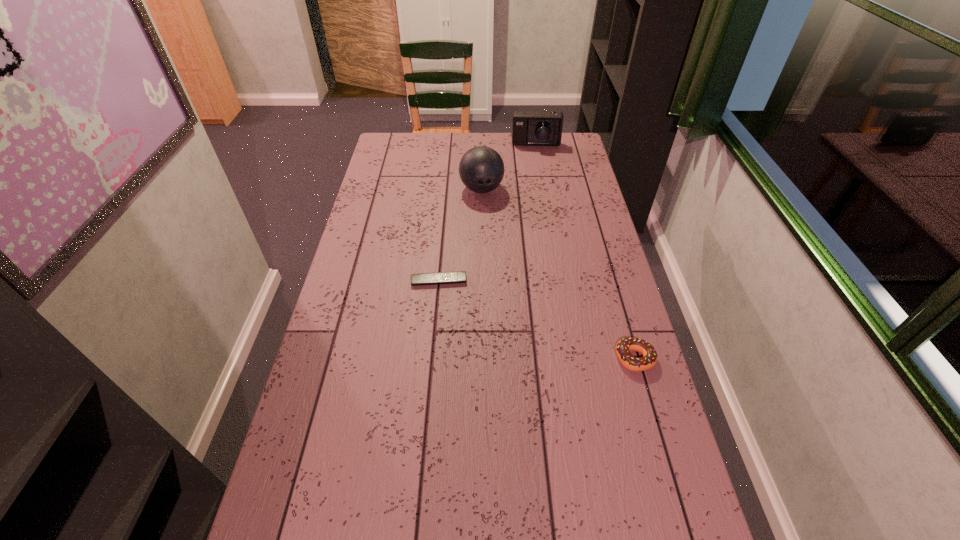
Where is `free space on the desktop that is between the remote control and the second shortest object and is positioned on the front-facing side of the farthest object`? The width and height of the screenshot is (960, 540). free space on the desktop that is between the remote control and the second shortest object and is positioned on the front-facing side of the farthest object is located at coordinates (531, 317).

Locate an element on the screen. The height and width of the screenshot is (540, 960). vacant space on the desktop that is between the second nearest object and the rightmost object and is positioned on the grip area of the tallest object is located at coordinates (510, 309).